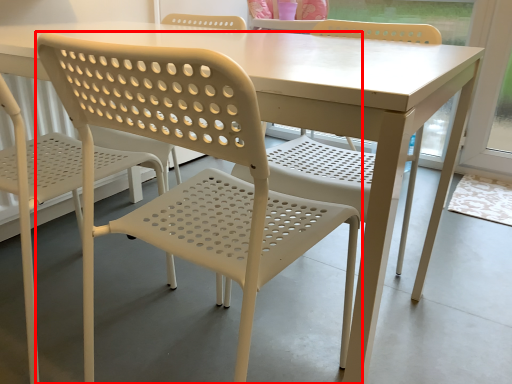
Question: From the image's perspective, considering the relative positions of chair (annotated by the red box) and chair in the image provided, where is chair (annotated by the red box) located with respect to the staircase?

Choices:
 (A) below
 (B) above

Answer: (A)